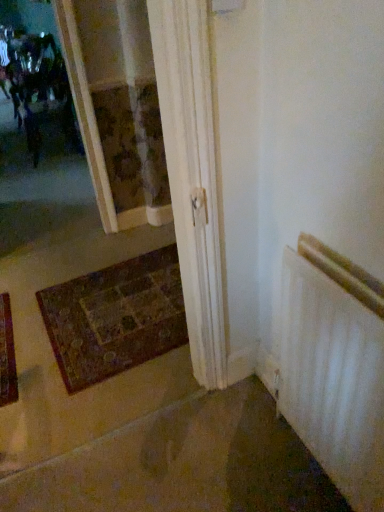
Question: Is white matte radiator at lower right far away from multicolored woven mat at lower left?

Choices:
 (A) yes
 (B) no

Answer: (A)

Question: From a real-world perspective, is white matte radiator at lower right below multicolored woven mat at lower left?

Choices:
 (A) no
 (B) yes

Answer: (A)

Question: Is white matte radiator at lower right with multicolored woven mat at lower left?

Choices:
 (A) no
 (B) yes

Answer: (A)

Question: Does white matte radiator at lower right appear on the right side of multicolored woven mat at lower left?

Choices:
 (A) yes
 (B) no

Answer: (A)

Question: Does white matte radiator at lower right have a larger size compared to multicolored woven mat at lower left?

Choices:
 (A) yes
 (B) no

Answer: (A)

Question: From the image's perspective, does white matte radiator at lower right appear lower than multicolored woven mat at lower left?

Choices:
 (A) no
 (B) yes

Answer: (B)

Question: From a real-world perspective, is multicolored woven mat at lower left positioned over white matte radiator at lower right based on gravity?

Choices:
 (A) no
 (B) yes

Answer: (A)

Question: Can you confirm if multicolored woven mat at lower left is positioned to the left of white matte radiator at lower right?

Choices:
 (A) yes
 (B) no

Answer: (A)

Question: From a real-world perspective, is multicolored woven mat at lower left below white matte radiator at lower right?

Choices:
 (A) yes
 (B) no

Answer: (A)

Question: Can white matte radiator at lower right be found inside multicolored woven mat at lower left?

Choices:
 (A) no
 (B) yes

Answer: (A)

Question: Does multicolored woven mat at lower left appear on the right side of white matte radiator at lower right?

Choices:
 (A) yes
 (B) no

Answer: (B)

Question: Is multicolored woven mat at lower left wider than white matte radiator at lower right?

Choices:
 (A) yes
 (B) no

Answer: (A)

Question: Looking at their shapes, would you say multicolored woven mat at lower left is wider or thinner than white matte radiator at lower right?

Choices:
 (A) wide
 (B) thin

Answer: (A)